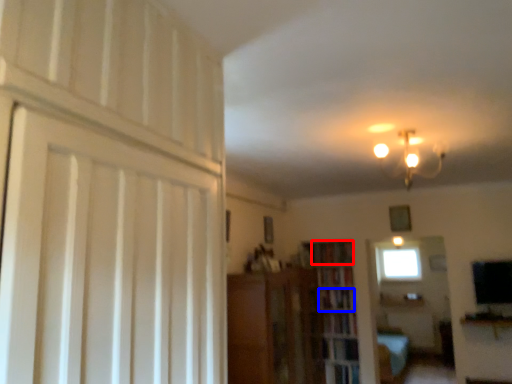
Question: Which point is further to the camera, book (highlighted by a red box) or book (highlighted by a blue box)?

Choices:
 (A) book
 (B) book

Answer: (A)